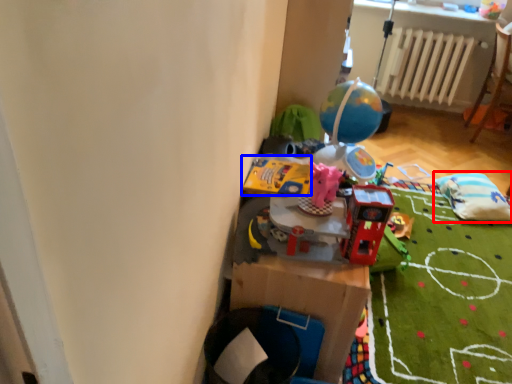
Question: Which point is further to the camera, bean bag chair (highlighted by a red box) or toy (highlighted by a blue box)?

Choices:
 (A) bean bag chair
 (B) toy

Answer: (A)